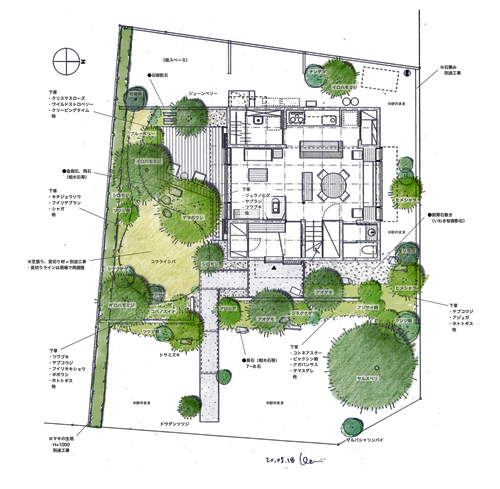
Identify the location of floorplan. This screenshot has width=500, height=489. (293, 174).